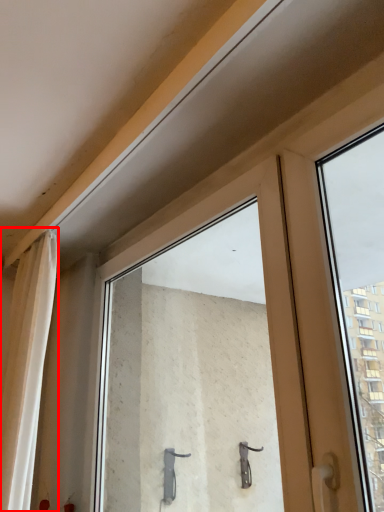
Question: Where is curtain (annotated by the red box) located in relation to window in the image?

Choices:
 (A) left
 (B) right

Answer: (A)